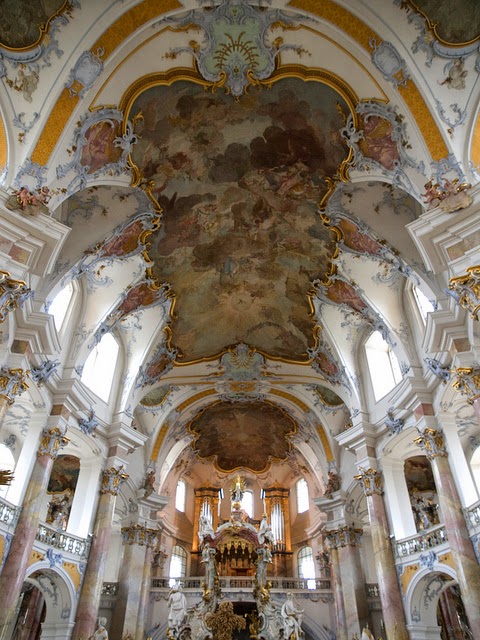
This screenshot has height=640, width=480. Identify the location of yellow and pink circular pillars. (450, 505), (378, 529), (22, 518), (97, 532), (2, 404), (477, 406).